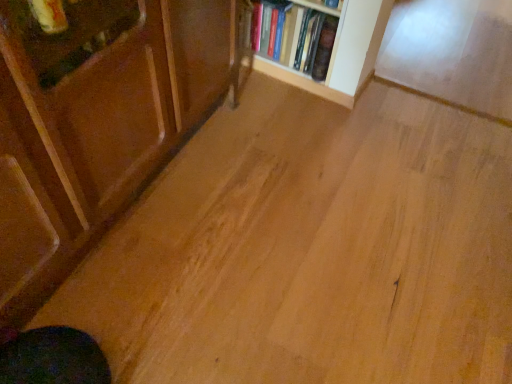
Image resolution: width=512 pixels, height=384 pixels. I want to click on hardcover book at upper right, so click(x=296, y=35).

This screenshot has height=384, width=512. Describe the element at coordinates (296, 35) in the screenshot. I see `hardcover book at upper right` at that location.

The image size is (512, 384). Identify the location of hardcover book at upper right. (296, 35).